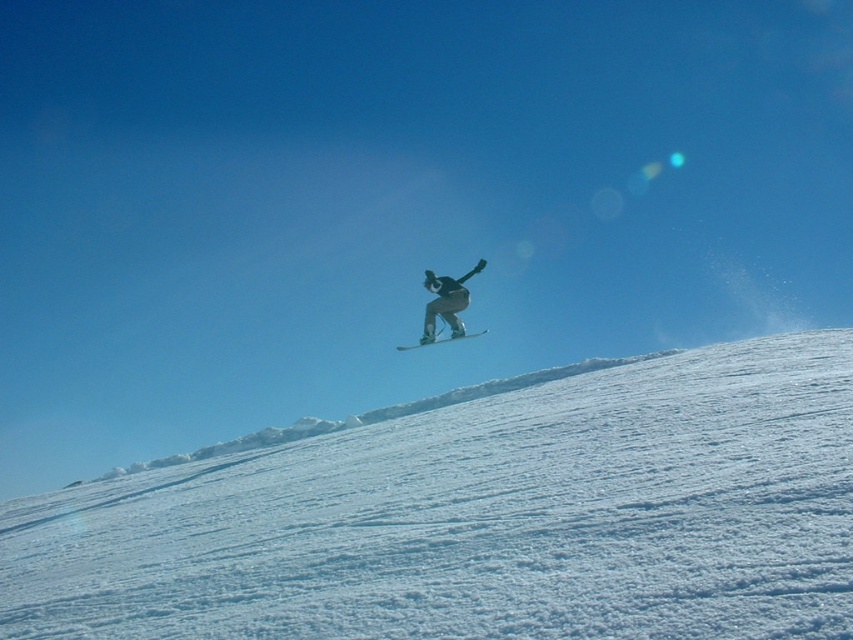
You are a photographer planning to capture the snowboarder and the snow in the scene. Given that the white powdery snow at center and the black matte snowboarder at center are both in focus, which object will occupy more of the frame horizontally?

The white powdery snow at center will occupy more of the frame horizontally because its width is larger than that of the black matte snowboarder at center.

You are a photographer trying to capture the snowboarder and their board in a photo. Based on the scene, which object, the black matte snowboarder at center or the white matte snowboard at center, appears larger in the image?

The black matte snowboarder at center appears larger in the image because it is much taller than the white matte snowboard at center.

You are a photographer trying to capture the snowboarder and the snowboard in the image. Which object, the white powdery snow at center or the white matte snowboard at center, has a larger surface area visible in the photo?

The white powdery snow at center has a larger surface area visible in the photo than the white matte snowboard at center.